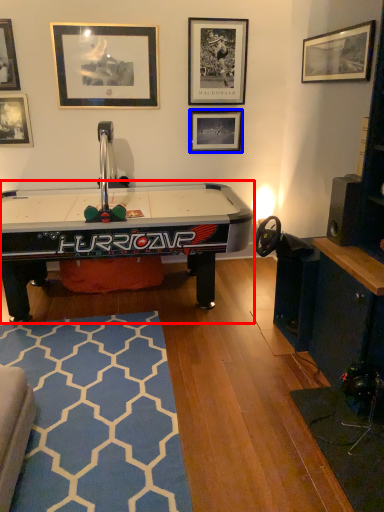
Question: Which object is closer to the camera taking this photo, table (highlighted by a red box) or picture frame (highlighted by a blue box)?

Choices:
 (A) table
 (B) picture frame

Answer: (A)